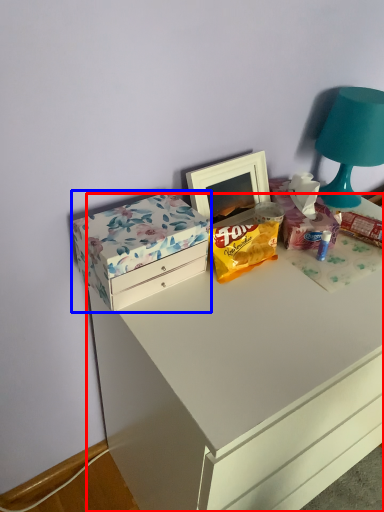
Question: Which point is further to the camera, chest of drawers (highlighted by a red box) or box (highlighted by a blue box)?

Choices:
 (A) chest of drawers
 (B) box

Answer: (B)